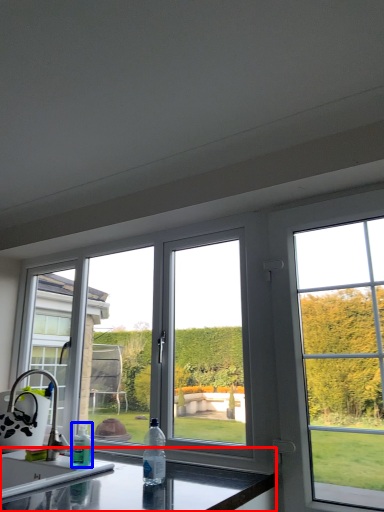
Question: Which object appears farthest to the camera in this image, countertop (highlighted by a red box) or bottle (highlighted by a blue box)?

Choices:
 (A) countertop
 (B) bottle

Answer: (B)